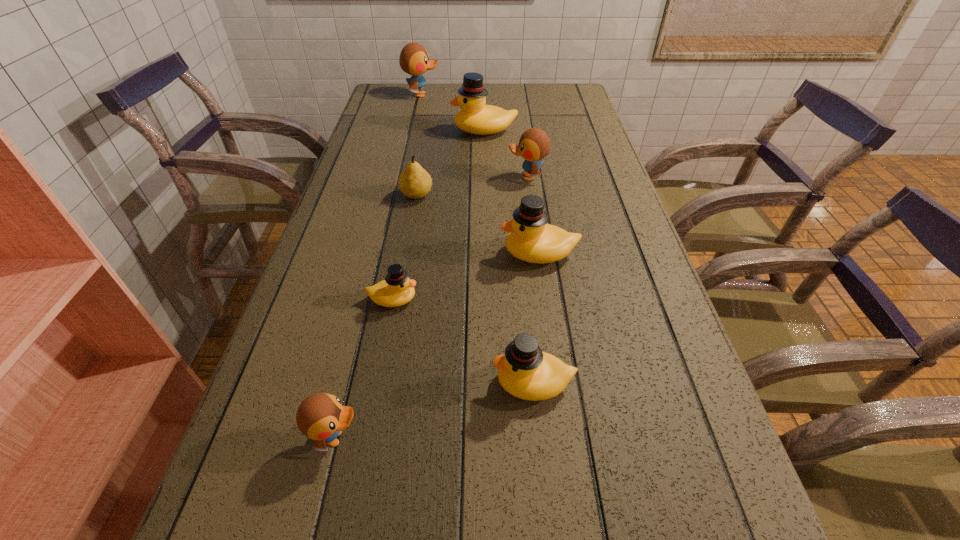
This screenshot has width=960, height=540. I want to click on the farthest duck, so click(414, 60).

Find the location of a particular element. The height and width of the screenshot is (540, 960). the biggest blue duck is located at coordinates (414, 60).

Find the location of `the biggest yellow duck`. the biggest yellow duck is located at coordinates (475, 117).

You are a GUI agent. You are given a task and a screenshot of the screen. Output one action in this format:
    pyautogui.click(x=<x>, y=<y>)
    Task: Click on the farthest yellow duck
    
    Given the screenshot: What is the action you would take?
    pyautogui.click(x=475, y=117)

Where is `the fourth nearest object`? the fourth nearest object is located at coordinates (531, 239).

Find the location of a particular element. Image resolution: width=960 pixels, height=540 pixels. the second biggest yellow duck is located at coordinates (531, 239).

Image resolution: width=960 pixels, height=540 pixels. I want to click on the second farthest blue duck, so coord(534,144).

You are a GUI agent. You are given a task and a screenshot of the screen. Output one action in this format:
    pyautogui.click(x=<x>, y=<y>)
    Task: Click on the second biggest blue duck
    This screenshot has width=960, height=540.
    Given the screenshot: What is the action you would take?
    pyautogui.click(x=534, y=144)

The image size is (960, 540). I want to click on pear, so click(414, 182).

Where is `the sixth farthest duck`? This screenshot has width=960, height=540. the sixth farthest duck is located at coordinates (525, 372).